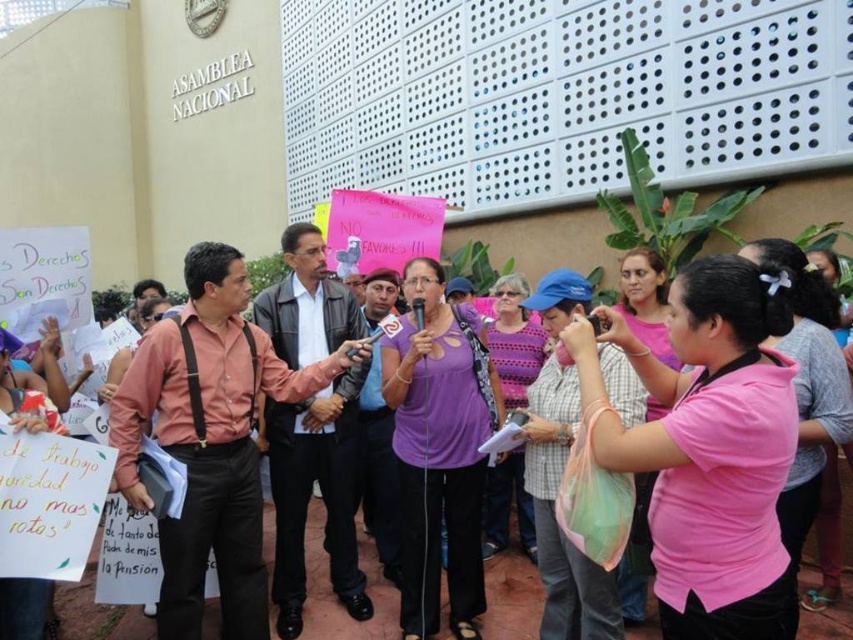
Question: Is matte pink shirt at center thinner than purple fabric shirt at center?

Choices:
 (A) no
 (B) yes

Answer: (B)

Question: Estimate the real-world distances between objects in this image. Which object is farther from the dark brown leather jacket at center?

Choices:
 (A) purple fabric shirt at center
 (B) matte pink shirt at center

Answer: (A)

Question: Estimate the real-world distances between objects in this image. Which object is farther from the dark brown leather jacket at center?

Choices:
 (A) purple fabric shirt at center
 (B) matte pink shirt at center

Answer: (A)

Question: In this image, where is dark brown leather jacket at center located relative to purple fabric shirt at center?

Choices:
 (A) left
 (B) right

Answer: (A)

Question: Can you confirm if dark brown leather jacket at center is wider than purple fabric shirt at center?

Choices:
 (A) yes
 (B) no

Answer: (B)

Question: Which point is farther from the camera taking this photo?

Choices:
 (A) (202, 284)
 (B) (830, 634)
 (C) (276, 410)

Answer: (C)